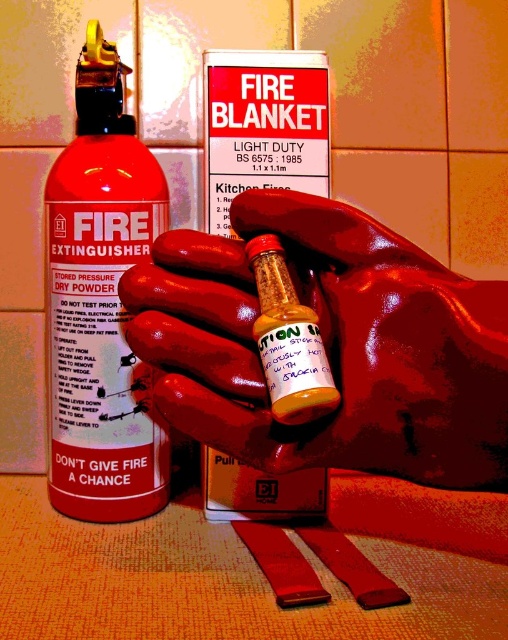
Question: Which point appears closest to the camera in this image?

Choices:
 (A) (220, 378)
 (B) (105, 115)

Answer: (A)

Question: Estimate the real-world distances between objects in this image. Which object is closer to the rubber glove at center?

Choices:
 (A) matte black fire extinguisher at left
 (B) translucent plastic bottle at center

Answer: (B)

Question: Is rubber glove at center behind translucent plastic bottle at center?

Choices:
 (A) no
 (B) yes

Answer: (A)

Question: Is rubber glove at center smaller than translucent plastic bottle at center?

Choices:
 (A) yes
 (B) no

Answer: (B)

Question: Which point is farther from the camera taking this photo?

Choices:
 (A) (274, 404)
 (B) (390, 442)
 (C) (50, 372)

Answer: (C)

Question: Does matte black fire extinguisher at left appear on the left side of translucent plastic bottle at center?

Choices:
 (A) no
 (B) yes

Answer: (B)